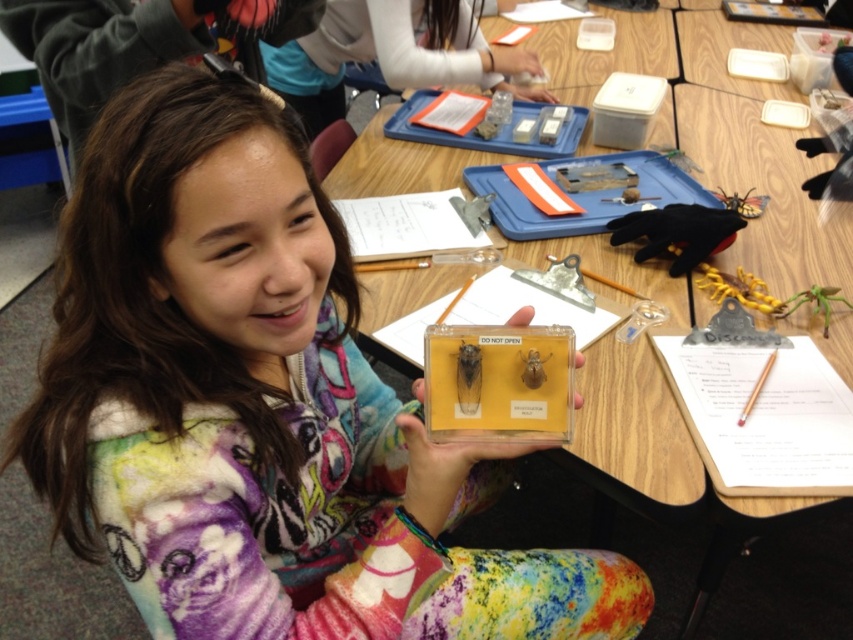
Which is more to the right, matte plastic tray at upper center or clear plastic containers at upper right?

clear plastic containers at upper right

In the scene shown: Is matte plastic tray at upper center thinner than clear plastic containers at upper right?

Incorrect, matte plastic tray at upper center's width is not less than clear plastic containers at upper right's.

Does point (293, 81) come farther from viewer compared to point (699, 35)?

No, (293, 81) is in front of (699, 35).

At what (x,y) coordinates should I click in order to perform the action: click on matte plastic tray at upper center. Please return your answer as a coordinate pair (x, y). The height and width of the screenshot is (640, 853). Looking at the image, I should click on (392, 54).

Looking at this image, who is positioned more to the right, translucent plastic container at center or clear plastic tray at center?

Positioned to the right is clear plastic tray at center.

Is translucent plastic container at center thinner than clear plastic tray at center?

Yes, translucent plastic container at center is thinner than clear plastic tray at center.

This screenshot has width=853, height=640. What do you see at coordinates (260, 406) in the screenshot? I see `translucent plastic container at center` at bounding box center [260, 406].

The width and height of the screenshot is (853, 640). In order to click on translucent plastic container at center in this screenshot , I will do `click(260, 406)`.

Between clear plastic tray at center and matte plastic tray at upper center, which one is positioned lower?

clear plastic tray at center is lower down.

Locate an element on the screen. The width and height of the screenshot is (853, 640). clear plastic tray at center is located at coordinates (679, 516).